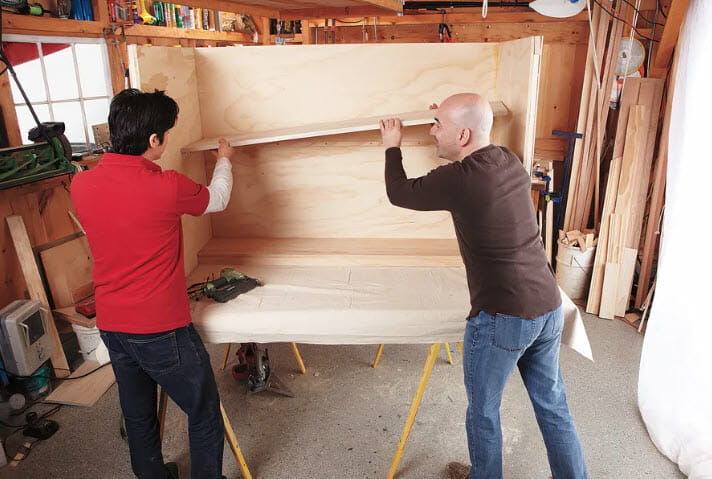
Find the location of a particular element. The image size is (712, 479). floor is located at coordinates (342, 413).